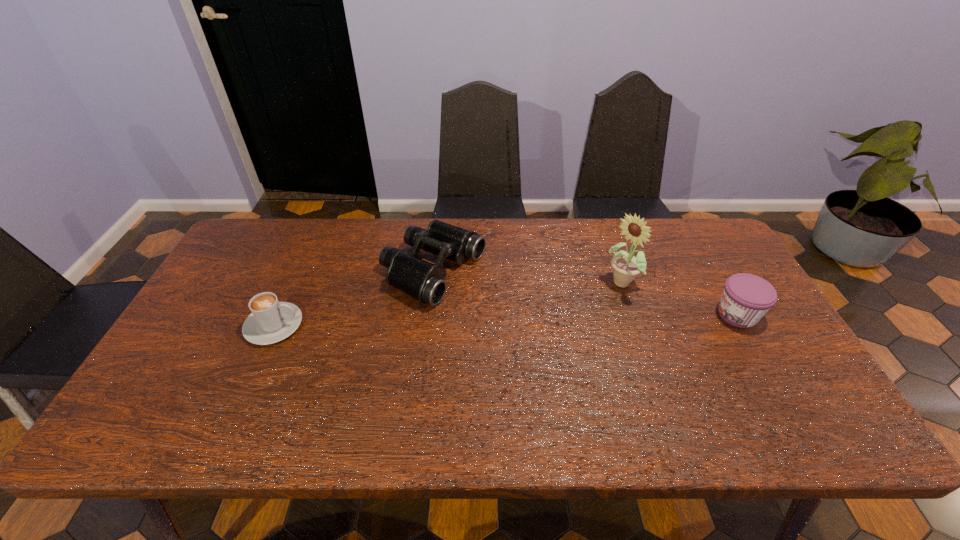
Identify the location of unoccupied area between the leftmost object and the sunflower. (447, 305).

Find the location of a particular element. This screenshot has height=540, width=960. free area in between the cappuccino and the third object from right to left is located at coordinates coord(353,299).

Where is `object identified as the third closest to the rightmost object`? This screenshot has width=960, height=540. object identified as the third closest to the rightmost object is located at coordinates (271, 321).

Select which object appears as the second closest to the second object from left to right. Please provide its 2D coordinates. Your answer should be formatted as a tuple, i.e. [(x, y)], where the tuple contains the x and y coordinates of a point satisfying the conditions above.

[(626, 266)]

At what (x,y) coordinates should I click in order to perform the action: click on free spot that satisfies the following two spatial constraints: 1. on the front side of the third object from right to left; 2. on the right side of the tallest object. Please return your answer as a coordinate pair (x, y). This screenshot has height=540, width=960. Looking at the image, I should click on (432, 284).

You are a GUI agent. You are given a task and a screenshot of the screen. Output one action in this format:
    pyautogui.click(x=<x>, y=<y>)
    Task: Click on the vacant region that satisfies the following two spatial constraints: 1. on the front side of the tallest object; 2. on the front label of the rightmost object
    
    Given the screenshot: What is the action you would take?
    pyautogui.click(x=632, y=315)

You are a GUI agent. You are given a task and a screenshot of the screen. Output one action in this format:
    pyautogui.click(x=<x>, y=<y>)
    Task: Click on the vacant space that satisfies the following two spatial constraints: 1. on the front side of the rightmost object; 2. on the front label of the second object from right to left
    This screenshot has width=960, height=540.
    Given the screenshot: What is the action you would take?
    pyautogui.click(x=632, y=315)